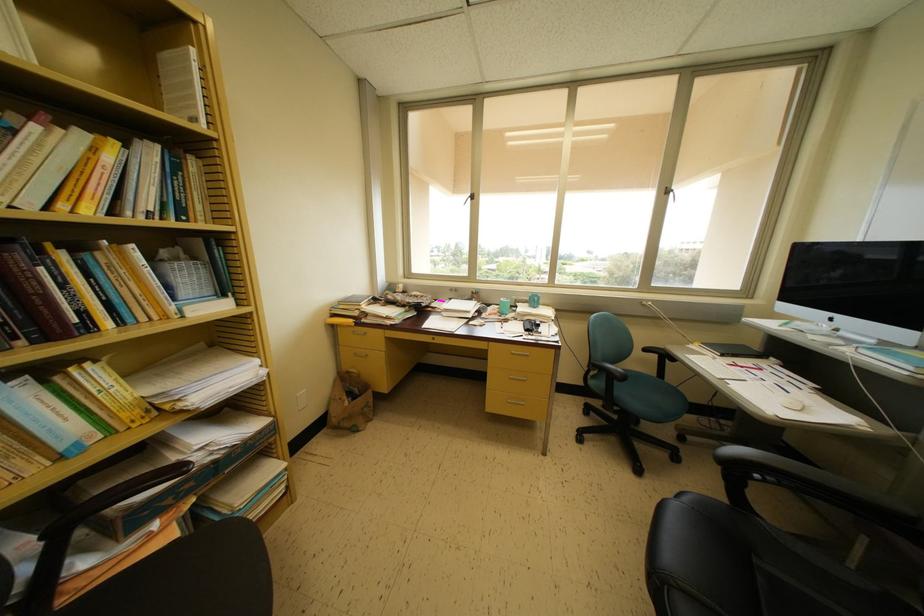
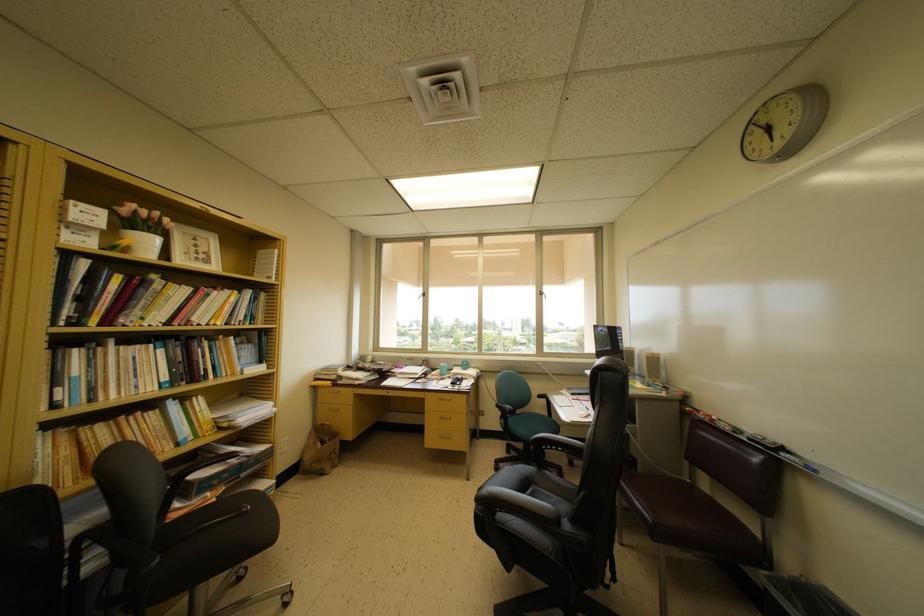
Where in the second image is the point corresponding to the point at 337,424 from the first image?

(310, 468)